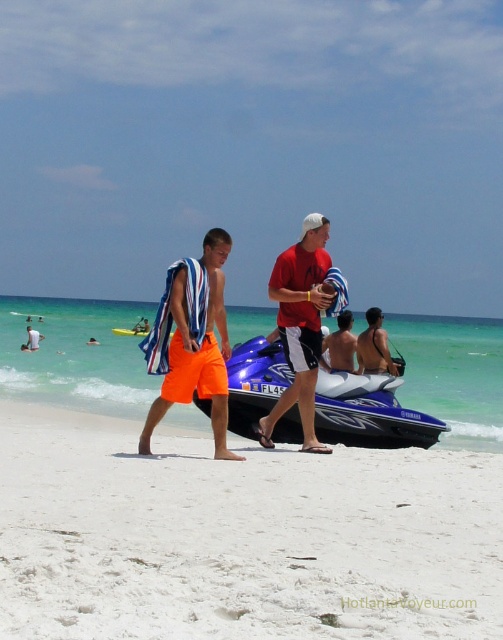
I want to click on white sandy beach at lower center, so coord(239,536).

Is the position of white sandy beach at lower center more distant than that of orange fabric towel at lower left?

No.

Is point (92, 532) behind point (33, 342)?

No, it is not.

This screenshot has height=640, width=503. I want to click on white sandy beach at lower center, so click(239, 536).

Can you confirm if metallic blue snowmobile at center is positioned to the right of orange cotton shorts at center?

Yes, metallic blue snowmobile at center is to the right of orange cotton shorts at center.

Is the position of metallic blue snowmobile at center less distant than that of orange cotton shorts at center?

No, it is behind orange cotton shorts at center.

Locate an element on the screen. The height and width of the screenshot is (640, 503). metallic blue snowmobile at center is located at coordinates (370, 412).

Does orange fabric towel at lower left come behind blue glossy jet ski at center?

No, it is not.

Does orange fabric towel at lower left have a greater width compared to blue glossy jet ski at center?

No, orange fabric towel at lower left is not wider than blue glossy jet ski at center.

Locate an element on the screen. orange fabric towel at lower left is located at coordinates (33, 339).

Find the location of `orange fabric towel at lower left`. orange fabric towel at lower left is located at coordinates (33, 339).